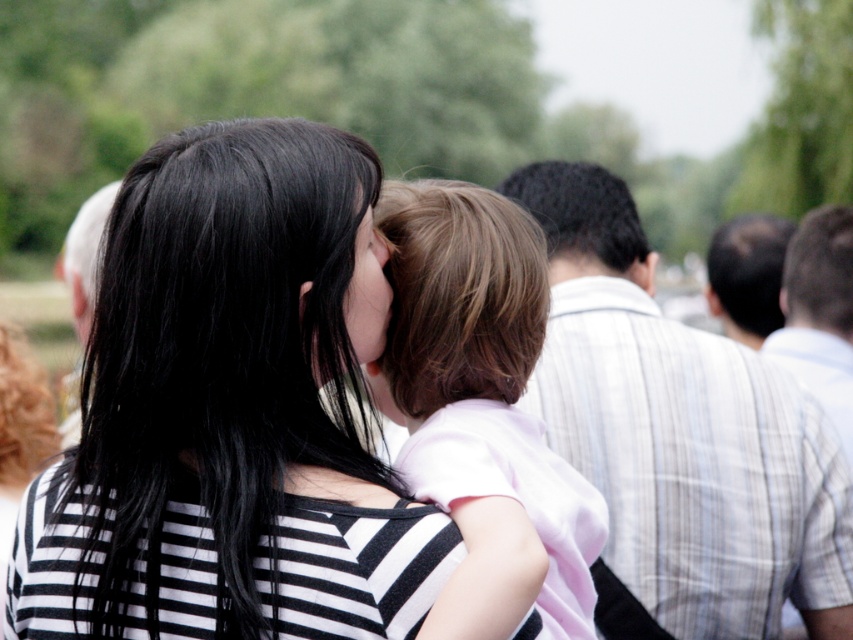
Question: Which point appears farthest from the camera in this image?

Choices:
 (A) (489, 259)
 (B) (364, 260)
 (C) (547, 420)

Answer: (C)

Question: Which object is closer to the camera taking this photo?

Choices:
 (A) smooth gray shirt at upper right
 (B) striped shirt at right

Answer: (B)

Question: Does black curly hair at upper center come behind smooth gray shirt at upper right?

Choices:
 (A) yes
 (B) no

Answer: (B)

Question: Is striped shirt at right smaller than white hair at left?

Choices:
 (A) no
 (B) yes

Answer: (B)

Question: Which object is farther from the camera taking this photo?

Choices:
 (A) black striped shirt at center
 (B) striped shirt at right
 (C) light brown hair at center
 (D) black curly hair at upper center

Answer: (B)

Question: Does black striped shirt at center lie in front of striped shirt at right?

Choices:
 (A) yes
 (B) no

Answer: (A)